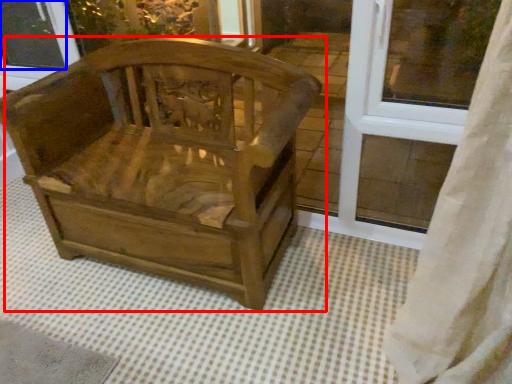
Question: Which of the following is the closest to the observer, chair (highlighted by a red box) or window screen (highlighted by a blue box)?

Choices:
 (A) chair
 (B) window screen

Answer: (A)